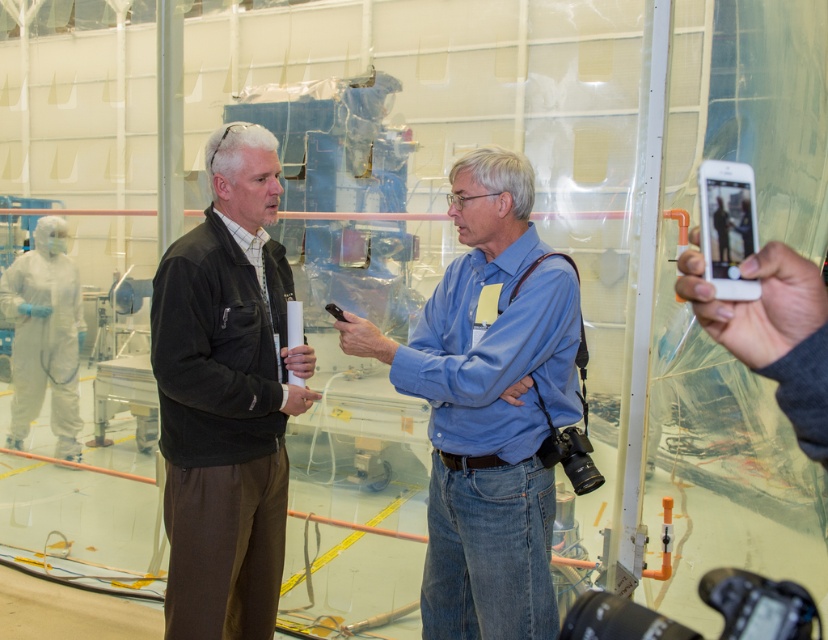
Question: Which of the following is the farthest from the observer?

Choices:
 (A) (209, 260)
 (B) (335, 316)
 (C) (437, 449)

Answer: (B)

Question: Which of the following is the closest to the observer?

Choices:
 (A) black plastic pen at center
 (B) dark brown corduroy jacket at center
 (C) blue denim jeans at center
 (D) white glossy phone at upper right

Answer: (D)

Question: In this image, where is dark brown corduroy jacket at center located relative to white glossy phone at upper right?

Choices:
 (A) below
 (B) above

Answer: (A)

Question: Which object is farther from the camera taking this photo?

Choices:
 (A) white glossy phone at upper right
 (B) dark brown corduroy jacket at center
 (C) black plastic pen at center
 (D) blue denim jeans at center

Answer: (C)

Question: Observing the image, what is the correct spatial positioning of blue denim jeans at center in reference to black plastic pen at center?

Choices:
 (A) above
 (B) below

Answer: (B)

Question: Considering the relative positions of white glossy phone at upper right and black plastic pen at center in the image provided, where is white glossy phone at upper right located with respect to black plastic pen at center?

Choices:
 (A) below
 (B) above

Answer: (B)